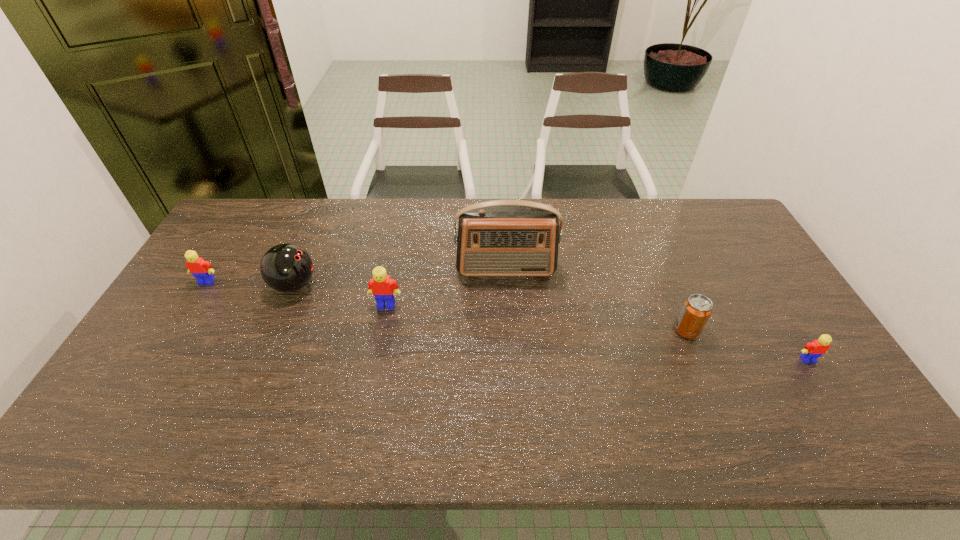
Find the location of a particular element. Image resolution: width=960 pixels, height=540 pixels. free spot that satisfies the following two spatial constraints: 1. on the front-facing side of the third object from left to right; 2. on the left side of the fifth farthest object is located at coordinates click(x=381, y=330).

This screenshot has width=960, height=540. I want to click on vacant space that satisfies the following two spatial constraints: 1. on the surface of the fifth object from right to left near the finger holes; 2. on the back side of the second nearest object, so click(276, 330).

What are the coordinates of `free space that satisfies the following two spatial constraints: 1. on the front-facing side of the radio receiver; 2. on the surface of the fifth object from right to left near the finger holes` in the screenshot? It's located at (507, 285).